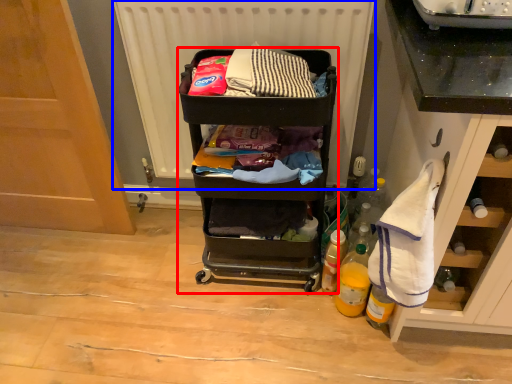
Question: Among these objects, which one is farthest to the camera, furniture (highlighted by a red box) or radiator (highlighted by a blue box)?

Choices:
 (A) furniture
 (B) radiator

Answer: (B)